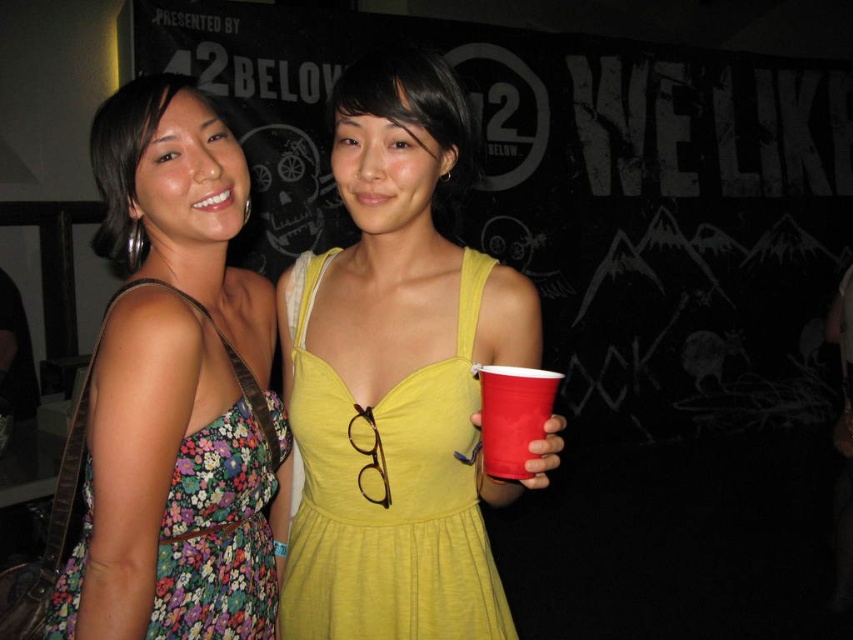
Does yellow fabric dress at center have a lesser height compared to red plastic cup at center?

No, yellow fabric dress at center is not shorter than red plastic cup at center.

How much distance is there between yellow fabric dress at center and red plastic cup at center?

The distance of yellow fabric dress at center from red plastic cup at center is 8.12 inches.

Is point (291, 310) farther from camera compared to point (479, 368)?

Yes, it is behind point (479, 368).

You are a GUI agent. You are given a task and a screenshot of the screen. Output one action in this format:
    pyautogui.click(x=<x>, y=<y>)
    Task: Click on the yellow fabric dress at center
    
    Given the screenshot: What is the action you would take?
    pyautogui.click(x=387, y=493)

Does floral fabric dress at left have a lesser width compared to red plastic cup at center?

In fact, floral fabric dress at left might be wider than red plastic cup at center.

This screenshot has height=640, width=853. Describe the element at coordinates (175, 388) in the screenshot. I see `floral fabric dress at left` at that location.

Identify the location of floral fabric dress at left. (175, 388).

Is floral fabric dress at left bigger than yellow fabric dress at center?

Correct, floral fabric dress at left is larger in size than yellow fabric dress at center.

Can you confirm if floral fabric dress at left is positioned to the right of yellow fabric dress at center?

Incorrect, floral fabric dress at left is not on the right side of yellow fabric dress at center.

Does point (155, 483) come farther from viewer compared to point (322, 529)?

No, (155, 483) is in front of (322, 529).

This screenshot has height=640, width=853. I want to click on floral fabric dress at left, so click(175, 388).